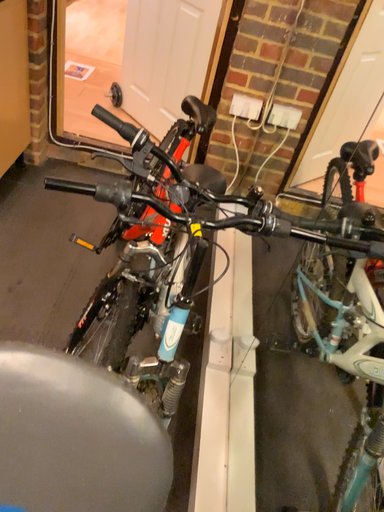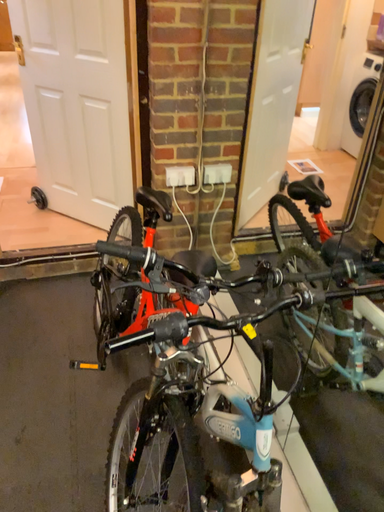
Question: How did the camera likely rotate when shooting the video?

Choices:
 (A) rotated downward
 (B) rotated upward

Answer: (B)